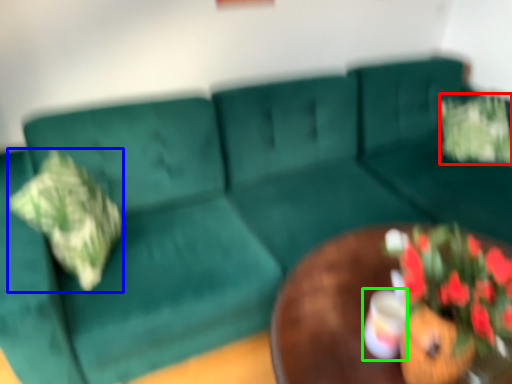
Question: Which object is positioned farthest from flower (highlighted by a red box)? Select from pillow (highlighted by a blue box) and coffee cup (highlighted by a green box).

Choices:
 (A) pillow
 (B) coffee cup

Answer: (A)